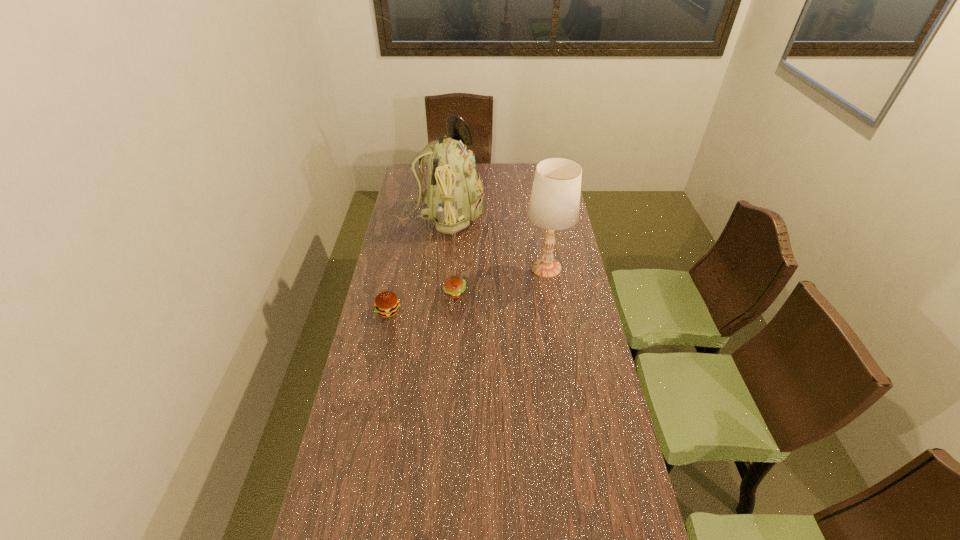
The height and width of the screenshot is (540, 960). Identify the location of backpack. (454, 195).

Where is `lamp`? The width and height of the screenshot is (960, 540). lamp is located at coordinates (554, 204).

You are a GUI agent. You are given a task and a screenshot of the screen. Output one action in this format:
    pyautogui.click(x=<x>, y=<y>)
    Task: Click on the rightmost object
    This screenshot has height=540, width=960.
    Given the screenshot: What is the action you would take?
    pyautogui.click(x=554, y=204)

You are a GUI agent. You are given a task and a screenshot of the screen. Output one action in this format:
    pyautogui.click(x=<x>, y=<y>)
    Task: Click on the nearest object
    
    Given the screenshot: What is the action you would take?
    pyautogui.click(x=386, y=304)

Identify the location of the nearer hamburger. (386, 304).

The height and width of the screenshot is (540, 960). Identify the location of the shortest object. (454, 286).

Identify the location of the right hamburger. The image size is (960, 540). (454, 286).

The width and height of the screenshot is (960, 540). I want to click on free spot located 0.150m on the front-facing side of the farthest object, so click(x=516, y=217).

Where is `vacant space located 0.330m on the back of the third nearest object`? vacant space located 0.330m on the back of the third nearest object is located at coordinates (537, 208).

This screenshot has height=540, width=960. Identify the location of vacant space located 0.070m on the back of the nearer hamburger. (393, 289).